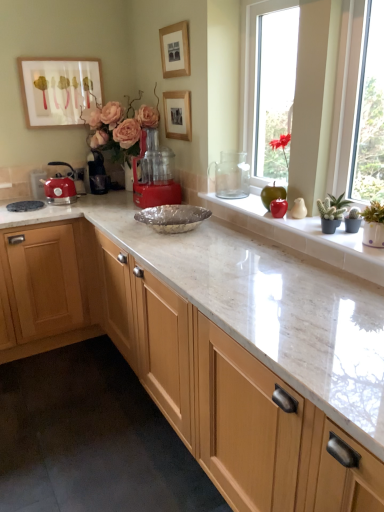
Measure the distance between red matte flower at upper right, the 1th plant viewed from the top, and camera.

red matte flower at upper right, the 1th plant viewed from the top, is 2.33 meters from camera.

Locate an element on the screen. This screenshot has width=384, height=512. red matte flower at upper right, which ranks as the second plant in right-to-left order is located at coordinates (281, 144).

Based on the photo, in order to face red plastic food processor at center, arranged as the second coffee machine when viewed from the left, should I rotate leftwards or rightwards?

Turn left approximately 4.837 degrees to face it.

Image resolution: width=384 pixels, height=512 pixels. I want to click on matte red kettle at left, so click(x=59, y=190).

This screenshot has width=384, height=512. I want to click on red matte flower at upper right, the first plant in the left-to-right sequence, so click(281, 144).

Looking at their sizes, would you say green matte apple at upper right is wider or thinner than matte red kettle at left?

Considering their sizes, green matte apple at upper right looks broader than matte red kettle at left.

Based on the photo, is green matte apple at upper right facing towards matte red kettle at left?

No, green matte apple at upper right is not oriented towards matte red kettle at left.

In terms of size, does green matte apple at upper right appear bigger or smaller than matte red kettle at left?

green matte apple at upper right is bigger than matte red kettle at left.

Considering the points (267, 234) and (56, 200), which point is behind, point (267, 234) or point (56, 200)?

The point (56, 200) is farther from the camera.

From the image's perspective, is clear glass vase at center below red plastic food processor at center, which is the first coffee machine in front-to-back order?

Incorrect, from the image's perspective, clear glass vase at center is higher than red plastic food processor at center, which is the first coffee machine in front-to-back order.

Is clear glass vase at center taller or shorter than red plastic food processor at center, which is the second coffee machine from back to front?

Considering their sizes, clear glass vase at center has more height than red plastic food processor at center, which is the second coffee machine from back to front.

Where is `window in front of the red plastic food processor at center, which is the second coffee machine from back to front`? This screenshot has height=512, width=384. window in front of the red plastic food processor at center, which is the second coffee machine from back to front is located at coordinates (271, 84).

Does point (92, 68) come in front of point (330, 240)?

No, (92, 68) is behind (330, 240).

Is matte white picture frame at upper left, which is the first picture frame in left-to-right order, far from green matte apple at upper right?

Yes.

Which of these two, matte white picture frame at upper left, the third picture frame when ordered from right to left, or green matte apple at upper right, stands taller?

matte white picture frame at upper left, the third picture frame when ordered from right to left, is taller.

Would you say matte white picture frame at upper left, which is the first picture frame in left-to-right order, contains green matte apple at upper right?

No, green matte apple at upper right is not a part of matte white picture frame at upper left, which is the first picture frame in left-to-right order.

Is matte red kettle at left thinner than green succulent at right, placed as the first plant when sorted from front to back?

Incorrect, the width of matte red kettle at left is not less than that of green succulent at right, placed as the first plant when sorted from front to back.

From the image's perspective, relative to green succulent at right, positioned as the 1th plant in right-to-left order, is matte red kettle at left above or below?

Clearly, from the image's perspective, matte red kettle at left is above green succulent at right, positioned as the 1th plant in right-to-left order.

Which object is further away from the camera, matte red kettle at left or green succulent at right, placed as the first plant when sorted from front to back?

matte red kettle at left is more distant.

Considering the sizes of matte white picture frame at upper left, the third picture frame when ordered from right to left, and wooden picture frame at upper center, positioned as the third picture frame in left-to-right order, in the image, is matte white picture frame at upper left, the third picture frame when ordered from right to left, bigger or smaller than wooden picture frame at upper center, positioned as the third picture frame in left-to-right order,?

Clearly, matte white picture frame at upper left, the third picture frame when ordered from right to left, is larger in size than wooden picture frame at upper center, positioned as the third picture frame in left-to-right order.

Considering the positions of point (37, 92) and point (181, 99), is point (37, 92) closer or farther from the camera than point (181, 99)?

Point (37, 92) is positioned farther from the camera compared to point (181, 99).

Which picture frame is the 1st one when counting from the front of the matte white picture frame at upper left, the third picture frame when ordered from right to left? Please provide its 2D coordinates.

[(177, 115)]

Is black plastic coffee machine at center, the second coffee machine when ordered from front to back, oriented towards red matte flower at upper right, the first plant in the left-to-right sequence?

No, black plastic coffee machine at center, the second coffee machine when ordered from front to back, does not turn towards red matte flower at upper right, the first plant in the left-to-right sequence.

Which of these two, black plastic coffee machine at center, the first coffee machine from the left, or red matte flower at upper right, the 2th plant when ordered from bottom to top, is thinner?

red matte flower at upper right, the 2th plant when ordered from bottom to top.

From a real-world perspective, does black plastic coffee machine at center, the second coffee machine when ordered from front to back, stand above red matte flower at upper right, placed as the second plant when sorted from front to back?

No.

Is wooden picture frame at upper center, the first picture frame in the right-to-left sequence, far from red matte flower at upper right, placed as the second plant when sorted from front to back?

No, wooden picture frame at upper center, the first picture frame in the right-to-left sequence, is in close proximity to red matte flower at upper right, placed as the second plant when sorted from front to back.

Does wooden picture frame at upper center, the first picture frame in the right-to-left sequence, have a greater width compared to red matte flower at upper right, the 1th plant viewed from the top?

Incorrect, the width of wooden picture frame at upper center, the first picture frame in the right-to-left sequence, does not surpass that of red matte flower at upper right, the 1th plant viewed from the top.

How many degrees apart are the facing directions of wooden picture frame at upper center, positioned as the third picture frame in left-to-right order, and red matte flower at upper right, the 2th plant when ordered from bottom to top?

They differ by 3.27 degrees in their facing directions.

From the image's perspective, which object appears higher, wooden picture frame at upper center, the first picture frame in the right-to-left sequence, or red matte flower at upper right, placed as the second plant when sorted from front to back?

wooden picture frame at upper center, the first picture frame in the right-to-left sequence, is shown above in the image.

Where is `window sill that appears below the matte red kettle at left (from the image's perspective)`? window sill that appears below the matte red kettle at left (from the image's perspective) is located at coordinates pyautogui.click(x=301, y=234).

The image size is (384, 512). In order to click on window in front of the red plastic food processor at center, which is the first coffee machine in front-to-back order in this screenshot , I will do tap(271, 84).

When comparing their distances from matte white picture frame at upper left, which is the first picture frame in left-to-right order, does wooden picture frame at upper center, positioned as the third picture frame in left-to-right order, or green succulent at right, positioned as the 1th plant in bottom-to-top order, seem further?

The object further to matte white picture frame at upper left, which is the first picture frame in left-to-right order, is green succulent at right, positioned as the 1th plant in bottom-to-top order.

Which object lies nearer to the anchor point matte white picture frame at upper left, the third picture frame when ordered from right to left, green matte apple at upper right or matte red kettle at left?

matte red kettle at left is closer to matte white picture frame at upper left, the third picture frame when ordered from right to left.

Based on the photo, when comparing their distances from red matte flower at upper right, the first plant in the left-to-right sequence, does matte white picture frame at upper left, which is the first picture frame in left-to-right order, or green matte apple at upper right seem closer?

The object closer to red matte flower at upper right, the first plant in the left-to-right sequence, is green matte apple at upper right.

Which object lies nearer to the anchor point red plastic food processor at center, which is the first coffee machine in front-to-back order, green matte apple at upper right or matte white picture frame at upper left, the third picture frame when ordered from right to left?

green matte apple at upper right lies closer to red plastic food processor at center, which is the first coffee machine in front-to-back order, than the other object.

From the image, which object appears to be nearer to wooden picture frame at upper center, acting as the 2th picture frame starting from the right, green matte apple at upper right or red matte flower at upper right, the 1th plant viewed from the top?

Based on the image, red matte flower at upper right, the 1th plant viewed from the top, appears to be nearer to wooden picture frame at upper center, acting as the 2th picture frame starting from the right.

From the image, which object appears to be nearer to wooden picture frame at upper center, acting as the second picture frame starting from the left, matte white picture frame at upper left, which is the first picture frame in left-to-right order, or black plastic coffee machine at center, the first coffee machine from the left?

matte white picture frame at upper left, which is the first picture frame in left-to-right order, is closer to wooden picture frame at upper center, acting as the second picture frame starting from the left.

Looking at the image, which one is located further to matte white picture frame at upper left, which is the first picture frame in left-to-right order, black plastic coffee machine at center, the first coffee machine from the left, or matte red kettle at left?

matte red kettle at left.

Consider the image. Looking at the image, which one is located closer to wooden picture frame at upper center, the first picture frame in the right-to-left sequence, matte red kettle at left or green succulent at right, which is counted as the 2th plant, starting from the back?

The object closer to wooden picture frame at upper center, the first picture frame in the right-to-left sequence, is matte red kettle at left.

You are a GUI agent. You are given a task and a screenshot of the screen. Output one action in this format:
    pyautogui.click(x=<x>, y=<y>)
    Task: Click on the plant between matte white picture frame at upper left, the third picture frame when ordered from right to left, and green matte apple at upper right
    This screenshot has width=384, height=512.
    Given the screenshot: What is the action you would take?
    pyautogui.click(x=281, y=144)

This screenshot has width=384, height=512. I want to click on coffee machine located between matte white picture frame at upper left, the third picture frame when ordered from right to left, and red plastic food processor at center, the 1th coffee machine viewed from the right, in the left-right direction, so click(96, 174).

At what (x,y) coordinates should I click in order to perform the action: click on kitchen appliance between matte red kettle at left and wooden picture frame at upper center, acting as the second picture frame starting from the left, from left to right. Please return your answer as a coordinate pair (x, y). Looking at the image, I should click on (59, 190).

The image size is (384, 512). What are the coordinates of `window sill located between matte white picture frame at upper left, which is the first picture frame in left-to-right order, and green succulent at right, placed as the second plant when sorted from left to right, in the left-right direction` in the screenshot? It's located at (301, 234).